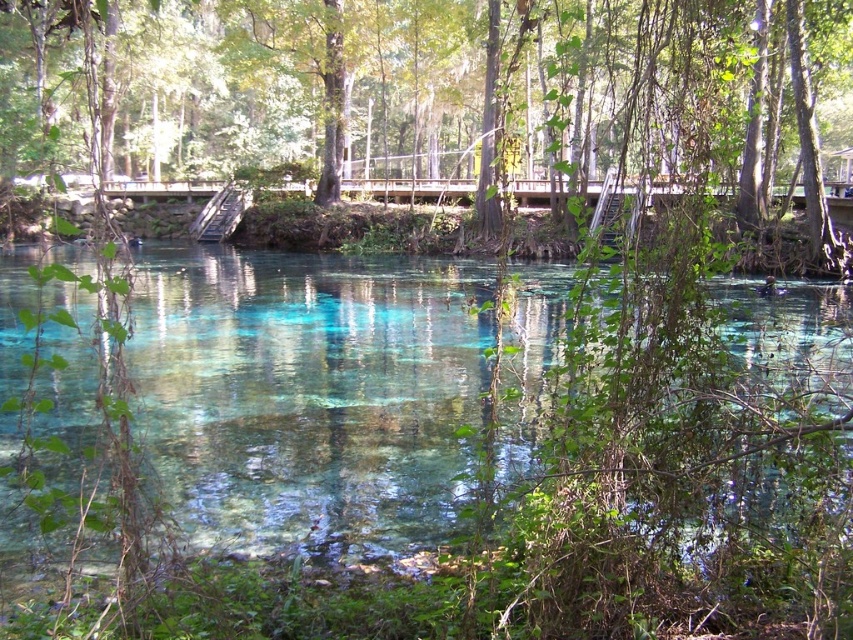
Question: Can you confirm if green leafy tree at center is positioned to the left of clear glassy water at center?

Choices:
 (A) no
 (B) yes

Answer: (B)

Question: Which point appears farthest from the camera in this image?

Choices:
 (A) (294, 26)
 (B) (3, 305)

Answer: (A)

Question: Which point appears farthest from the camera in this image?

Choices:
 (A) (238, 16)
 (B) (809, 352)

Answer: (A)

Question: Does green leafy tree at center have a greater width compared to clear glassy water at center?

Choices:
 (A) yes
 (B) no

Answer: (A)

Question: Does green leafy tree at center have a greater width compared to clear glassy water at center?

Choices:
 (A) no
 (B) yes

Answer: (B)